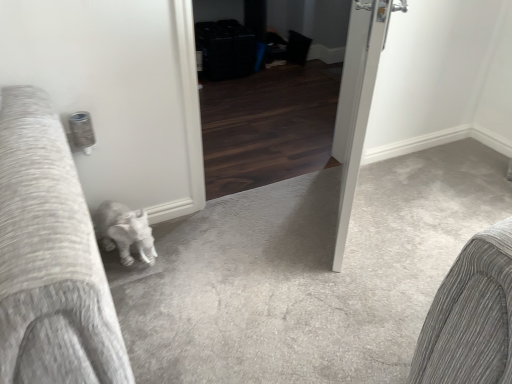
Question: Considering the relative sizes of dark wood screen door at center and white glossy door at center in the image provided, is dark wood screen door at center taller than white glossy door at center?

Choices:
 (A) no
 (B) yes

Answer: (A)

Question: Does dark wood screen door at center lie in front of white glossy door at center?

Choices:
 (A) yes
 (B) no

Answer: (B)

Question: Is dark wood screen door at center bigger than white glossy door at center?

Choices:
 (A) no
 (B) yes

Answer: (B)

Question: From the image's perspective, would you say dark wood screen door at center is shown under white glossy door at center?

Choices:
 (A) yes
 (B) no

Answer: (B)

Question: Is dark wood screen door at center thinner than white glossy door at center?

Choices:
 (A) no
 (B) yes

Answer: (A)

Question: Are dark wood screen door at center and white glossy door at center making contact?

Choices:
 (A) no
 (B) yes

Answer: (A)

Question: Is white glossy door at center further to the viewer compared to dark wood screen door at center?

Choices:
 (A) no
 (B) yes

Answer: (A)

Question: Considering the relative sizes of white glossy door at center and dark wood screen door at center in the image provided, is white glossy door at center bigger than dark wood screen door at center?

Choices:
 (A) yes
 (B) no

Answer: (B)

Question: Is white glossy door at center positioned far away from dark wood screen door at center?

Choices:
 (A) yes
 (B) no

Answer: (B)

Question: Is white glossy door at center shorter than dark wood screen door at center?

Choices:
 (A) yes
 (B) no

Answer: (B)

Question: From a real-world perspective, is white glossy door at center physically above dark wood screen door at center?

Choices:
 (A) no
 (B) yes

Answer: (B)

Question: Is white glossy door at center beside dark wood screen door at center?

Choices:
 (A) yes
 (B) no

Answer: (B)

Question: Which is correct: white glossy door at center is inside dark wood screen door at center, or outside of it?

Choices:
 (A) inside
 (B) outside

Answer: (B)